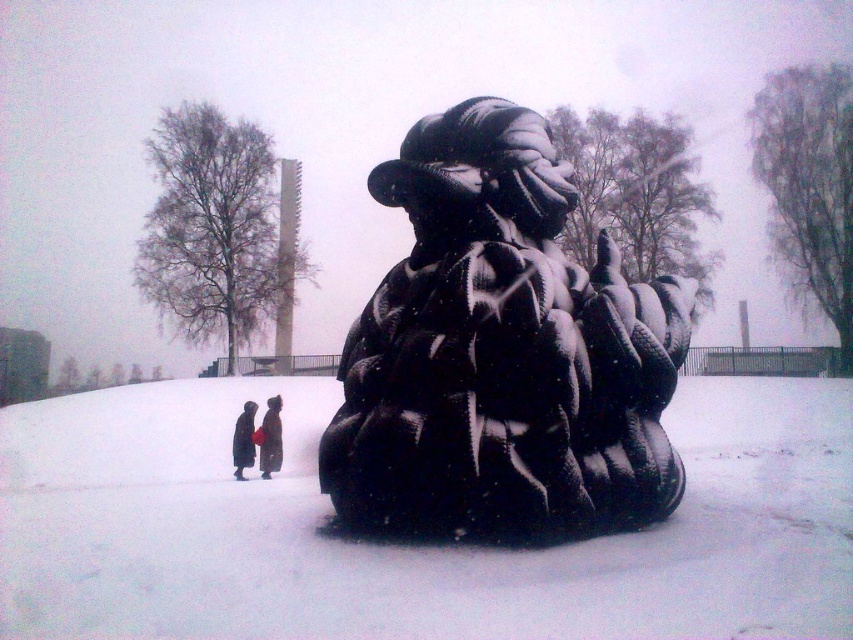
You are standing in the snowy area and want to take a photo of both the sculpture at center and the dark brown fur coat at lower center. Can you position yourself so that both are fully visible in the frame without moving either object?

The sculpture at center is above the dark brown fur coat at lower center, so if you position yourself at a lower angle, you can capture both the sculpture and the coat in the frame since they are vertically aligned.

You are standing in the snowy area and want to take a photo of the sculpture at center and the dark brown fur coat at lower center together in the frame. Considering their sizes, will you need to move closer or farther away from the sculpture to include both in the photo?

The sculpture at center is much taller than the dark brown fur coat at lower center. To include both in the photo, you would need to move farther away from the sculpture to capture its full height while also fitting the smaller dark brown fur coat at lower center into the frame.

You are standing in the snowy area and want to take a photo of the sculpture at center and the dark brown coat at center. Which object should you zoom in on to capture both in the frame without moving your camera?

You should zoom in on the dark brown coat at center because the sculpture at center might be wider than it, so focusing on the smaller object allows both to fit in the frame.